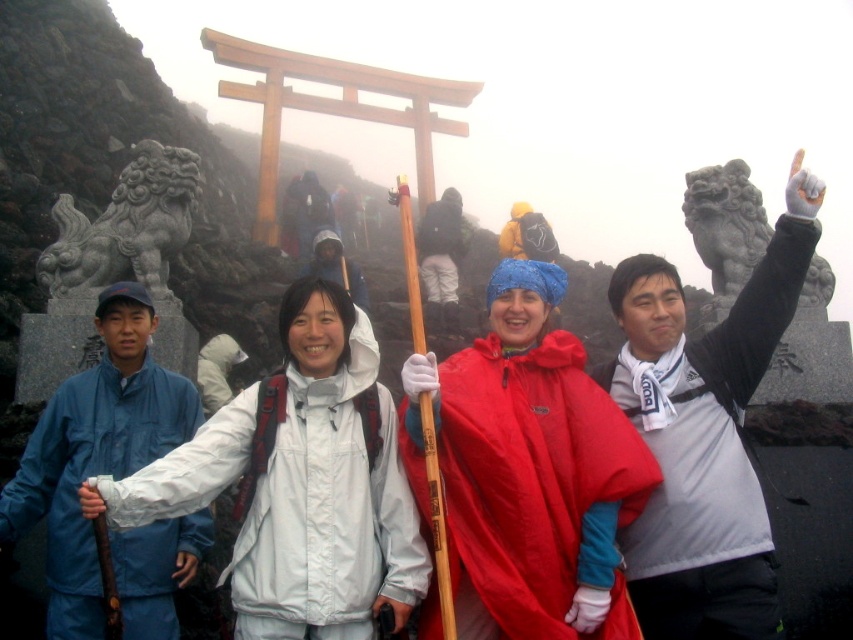
You are a photographer taking a group photo at the shrine entrance. You want to ensure that the red matte raincoat at center and the gray stone lion at left are both visible in the frame. Considering their sizes, which object should be placed closer to the camera to balance their visibility?

The gray stone lion at left should be placed closer to the camera because the red matte raincoat at center is much taller than the gray stone lion at left. By positioning the smaller gray stone lion at left closer, it can appear larger in the frame, balancing its visibility with the taller red matte raincoat at center.

You are standing at the entrance of the shrine and see a group of people. There is a point marked at coordinates (527, 470). What object is located at that point?

The point at coordinates (527, 470) corresponds to the red matte raincoat at center.

You are a photographer trying to position a new subject exactly where the white matte jacket at center was in the image. What coordinates should you aim for?

The white matte jacket at center was positioned at coordinates point (328, 490), so you should aim for those coordinates to place the new subject in the same spot.